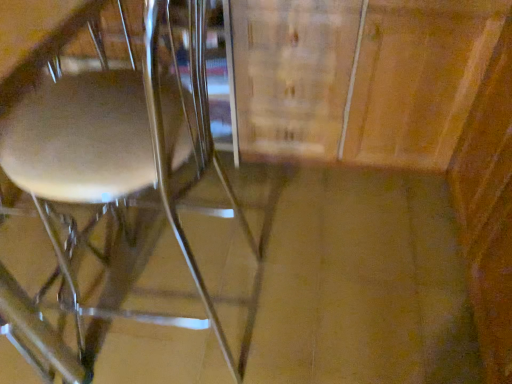
Question: Is wooden cabinet at center wider than metallic silver chair at left?

Choices:
 (A) no
 (B) yes

Answer: (A)

Question: Considering the relative sizes of wooden cabinet at center and metallic silver chair at left in the image provided, is wooden cabinet at center bigger than metallic silver chair at left?

Choices:
 (A) yes
 (B) no

Answer: (B)

Question: Would you say metallic silver chair at left is part of wooden cabinet at center's contents?

Choices:
 (A) no
 (B) yes

Answer: (A)

Question: From the image's perspective, is wooden cabinet at center over metallic silver chair at left?

Choices:
 (A) no
 (B) yes

Answer: (B)

Question: Considering the relative sizes of wooden cabinet at center and metallic silver chair at left in the image provided, is wooden cabinet at center thinner than metallic silver chair at left?

Choices:
 (A) yes
 (B) no

Answer: (A)

Question: Is wooden cabinet at center not near metallic silver chair at left?

Choices:
 (A) no
 (B) yes

Answer: (A)

Question: Can you confirm if metallic silver chair at left is taller than wooden cabinet at center?

Choices:
 (A) yes
 (B) no

Answer: (A)

Question: Could you tell me if metallic silver chair at left is facing wooden cabinet at center?

Choices:
 (A) yes
 (B) no

Answer: (B)

Question: Is metallic silver chair at left thinner than wooden cabinet at center?

Choices:
 (A) yes
 (B) no

Answer: (B)

Question: Is wooden cabinet at center inside metallic silver chair at left?

Choices:
 (A) no
 (B) yes

Answer: (A)

Question: Is metallic silver chair at left far away from wooden cabinet at center?

Choices:
 (A) no
 (B) yes

Answer: (A)

Question: Is metallic silver chair at left not inside wooden cabinet at center?

Choices:
 (A) yes
 (B) no

Answer: (A)

Question: From the image's perspective, is metallic silver chair at left located above or below wooden cabinet at center?

Choices:
 (A) below
 (B) above

Answer: (A)